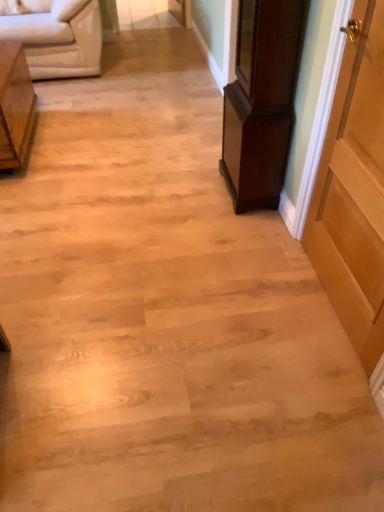
The image size is (384, 512). I want to click on unoccupied area in front of dark wood cabinet at right, which is counted as the first furniture, starting from the right, so click(238, 229).